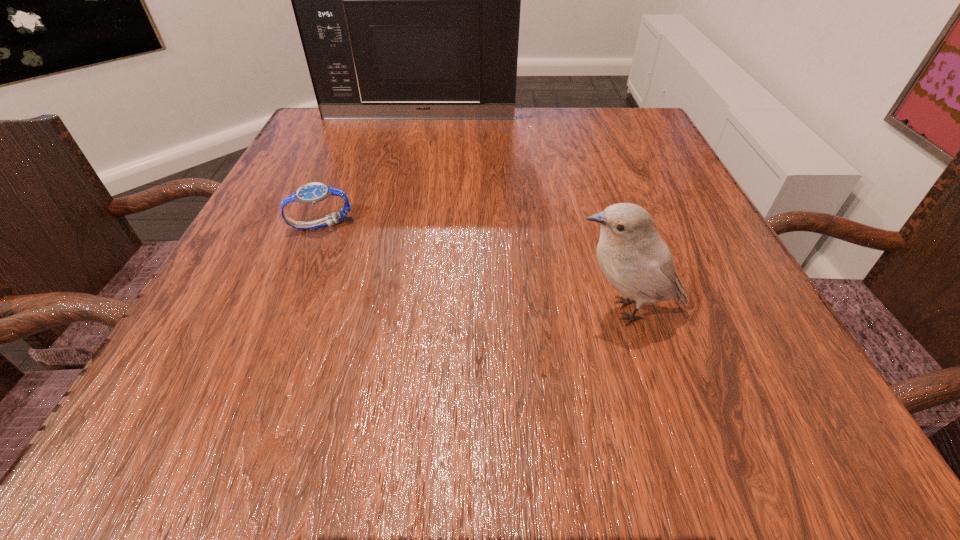
Find the location of a particular element. The height and width of the screenshot is (540, 960). free point between the watch and the second tallest object is located at coordinates (473, 268).

Find the location of a particular element. The image size is (960, 540). empty location between the watch and the microwave oven is located at coordinates (370, 171).

The width and height of the screenshot is (960, 540). I want to click on free space between the tallest object and the shortest object, so click(x=370, y=171).

Choose which object is the second nearest neighbor to the tallest object. Please provide its 2D coordinates. Your answer should be formatted as a tuple, i.e. [(x, y)], where the tuple contains the x and y coordinates of a point satisfying the conditions above.

[(637, 262)]

Where is `object identified as the closest to the microwave oven`? The height and width of the screenshot is (540, 960). object identified as the closest to the microwave oven is located at coordinates (311, 193).